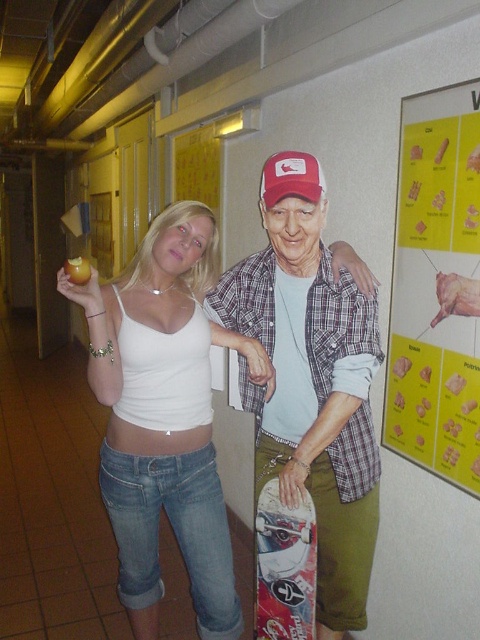
What are the coordinates of `plaid fabric shirt at center` in the screenshot? It's located at (312, 394).

Who is more distant from viewer, (332, 490) or (420, 154)?

The point (420, 154) is behind.

Is point (332, 374) farther from camera compared to point (396, 353)?

No, it is in front of (396, 353).

I want to click on plaid fabric shirt at center, so click(312, 394).

How much distance is there between yellow paper poster at upper right and white glossy skateboard at lower center?

yellow paper poster at upper right and white glossy skateboard at lower center are 62.43 centimeters apart from each other.

Measure the distance between point (418, 112) and camera.

They are 1.70 meters apart.

This screenshot has height=640, width=480. What are the coordinates of `yellow paper poster at upper right` in the screenshot? It's located at (436, 289).

Does plaid fabric shirt at center have a lesser width compared to white glossy skateboard at lower center?

In fact, plaid fabric shirt at center might be wider than white glossy skateboard at lower center.

Identify the location of plaid fabric shirt at center. (312, 394).